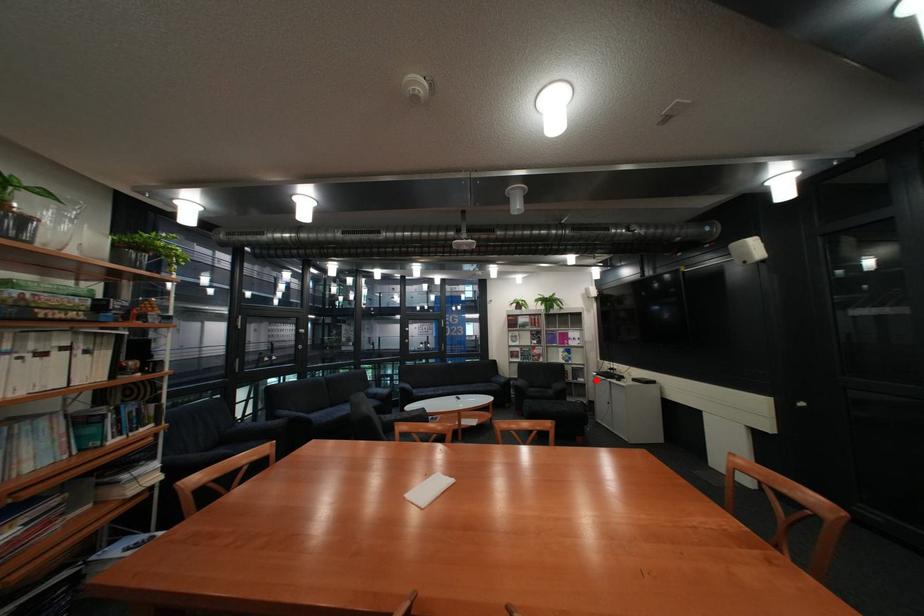
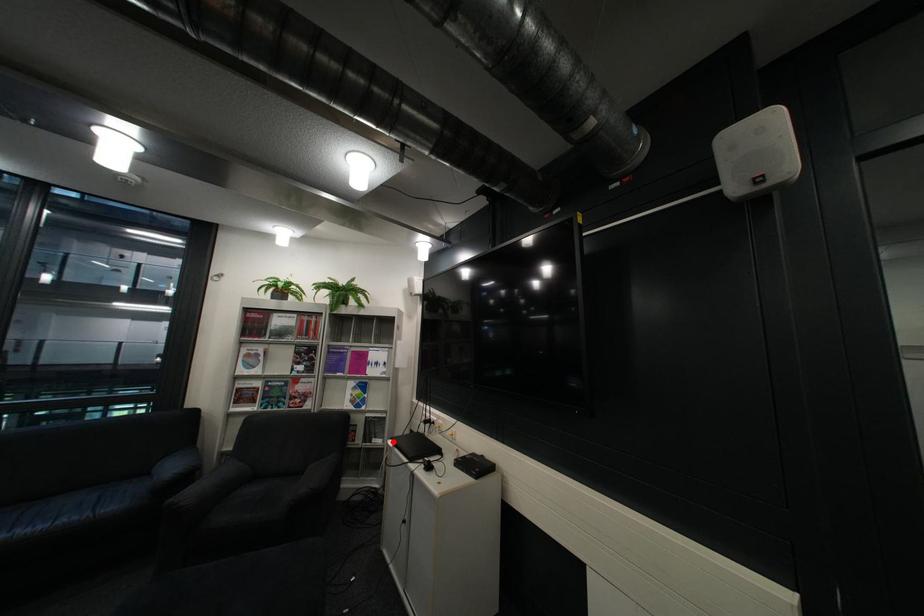
I am providing you with two images of the same scene from different viewpoints. A red point is marked on the first image and another point is marked on the second image. Does the point marked in image1 correspond to the same location as the one in image2?

Yes